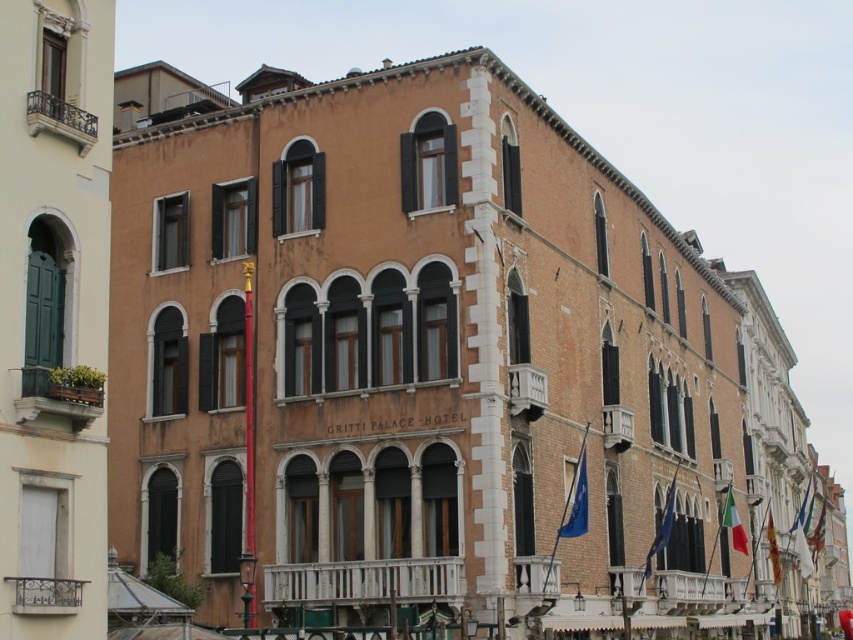
Is point (585, 512) less distant than point (728, 506)?

Yes.

Is the position of blue fabric flag at lower center more distant than that of italian flag at center?

No, it is in front of italian flag at center.

You are a GUI agent. You are given a task and a screenshot of the screen. Output one action in this format:
    pyautogui.click(x=<x>, y=<y>)
    Task: Click on the blue fabric flag at lower center
    The width and height of the screenshot is (853, 640).
    Given the screenshot: What is the action you would take?
    pyautogui.click(x=577, y=502)

Where is `blue fabric flag at lower right`? blue fabric flag at lower right is located at coordinates (660, 529).

Looking at this image, who is more distant from viewer, (654, 547) or (770, 563)?

The point (770, 563) is more distant.

Identify the location of blue fabric flag at lower right. The height and width of the screenshot is (640, 853). (660, 529).

Is italian flag at center wider than green fabric flag at lower right?

No, italian flag at center is not wider than green fabric flag at lower right.

Which is in front, point (746, 547) or point (766, 532)?

Positioned in front is point (746, 547).

Where is `italian flag at center`? This screenshot has width=853, height=640. italian flag at center is located at coordinates (734, 524).